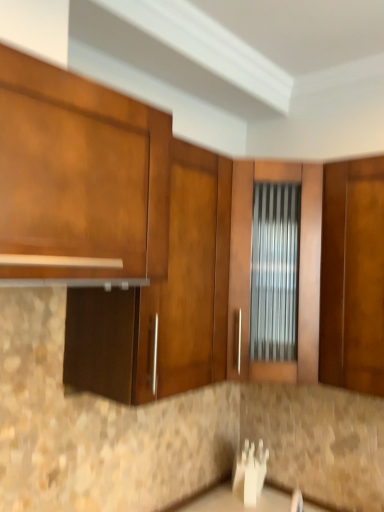
Question: Is matte wood cabinet at center, which ranks as the second cabinetry in front-to-back order, wider or thinner than matte wood cabinet at upper left, marked as the 2th cabinetry in a back-to-front arrangement?

Choices:
 (A) wide
 (B) thin

Answer: (B)

Question: In terms of height, does matte wood cabinet at center, the 1th cabinetry positioned from the back, look taller or shorter compared to matte wood cabinet at upper left, placed as the 1th cabinetry when sorted from front to back?

Choices:
 (A) tall
 (B) short

Answer: (A)

Question: Choose the correct answer: Is matte wood cabinet at center, the 1th cabinetry positioned from the back, inside matte wood cabinet at upper left, placed as the 1th cabinetry when sorted from front to back, or outside it?

Choices:
 (A) outside
 (B) inside

Answer: (A)

Question: In terms of size, does matte wood cabinet at upper left, placed as the 1th cabinetry when sorted from front to back, appear bigger or smaller than matte wood cabinet at center, the 1th cabinetry positioned from the back?

Choices:
 (A) big
 (B) small

Answer: (B)

Question: Considering the relative positions of matte wood cabinet at upper left, placed as the 1th cabinetry when sorted from front to back, and matte wood cabinet at center, which ranks as the second cabinetry in front-to-back order, in the image provided, is matte wood cabinet at upper left, placed as the 1th cabinetry when sorted from front to back, to the left or to the right of matte wood cabinet at center, which ranks as the second cabinetry in front-to-back order,?

Choices:
 (A) left
 (B) right

Answer: (A)

Question: From a real-world perspective, is matte wood cabinet at upper left, placed as the 1th cabinetry when sorted from front to back, above or below matte wood cabinet at center, the 1th cabinetry positioned from the back?

Choices:
 (A) below
 (B) above

Answer: (B)

Question: Is point (157, 193) positioned closer to the camera than point (218, 309)?

Choices:
 (A) farther
 (B) closer

Answer: (B)